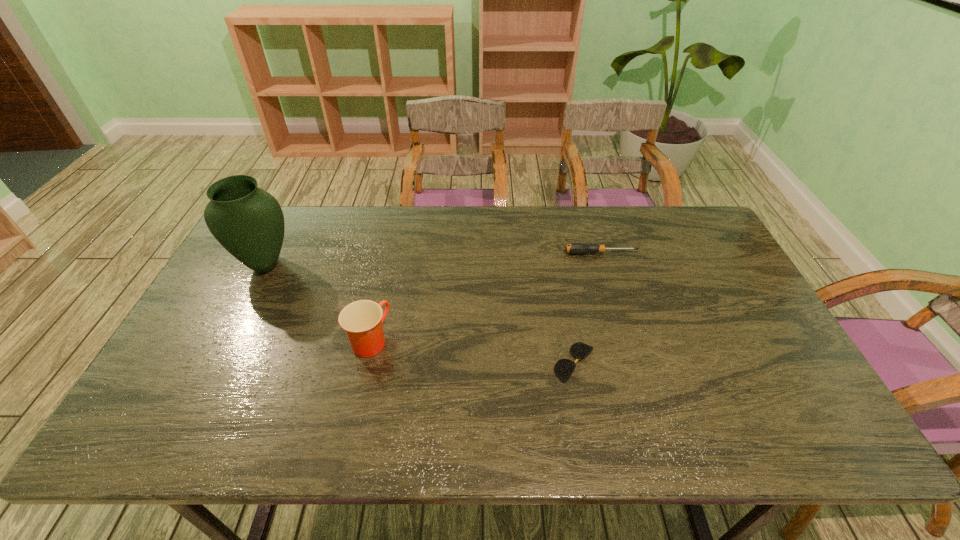
You are a GUI agent. You are given a task and a screenshot of the screen. Output one action in this format:
    pyautogui.click(x=<x>, y=<y>)
    Task: Click on the leftmost object
    Image resolution: width=960 pixels, height=540 pixels.
    Given the screenshot: What is the action you would take?
    pyautogui.click(x=247, y=221)

Identify the location of vase. This screenshot has height=540, width=960. (247, 221).

Find the location of `the third shortest object`. the third shortest object is located at coordinates pos(362,320).

Locate an element on the screen. cup is located at coordinates (362, 320).

Find the location of a particular element. The width and height of the screenshot is (960, 540). screwdriver is located at coordinates (574, 248).

Where is `the shortest object`? the shortest object is located at coordinates (563, 368).

Find the location of a particular element. vacant region located 0.120m on the back of the vase is located at coordinates (285, 227).

Find the location of `vacant space situated 0.300m on the back of the second object from left to right`. vacant space situated 0.300m on the back of the second object from left to right is located at coordinates (390, 251).

I want to click on free location located 0.190m on the back of the third tallest object, so click(x=589, y=215).

I want to click on vacant space located 0.380m on the left of the spectacles, so click(x=404, y=363).